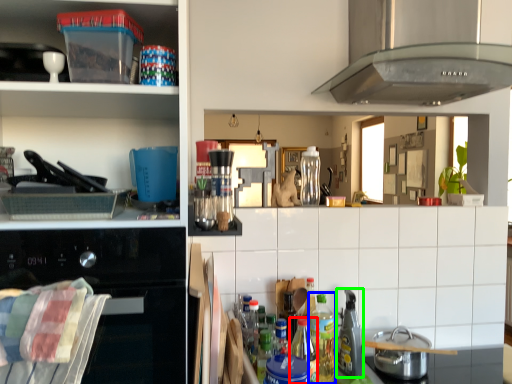
Question: Based on their relative distances, which object is nearer to bottle (highlighted by a red box)? Choose from bottle (highlighted by a blue box) and appliance (highlighted by a green box).

Choices:
 (A) bottle
 (B) appliance

Answer: (A)